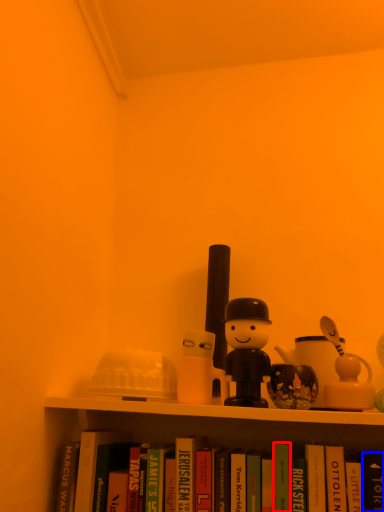
Question: Which object appears closest to the camera in this image, paperback book (highlighted by a red box) or paperback book (highlighted by a blue box)?

Choices:
 (A) paperback book
 (B) paperback book

Answer: (B)